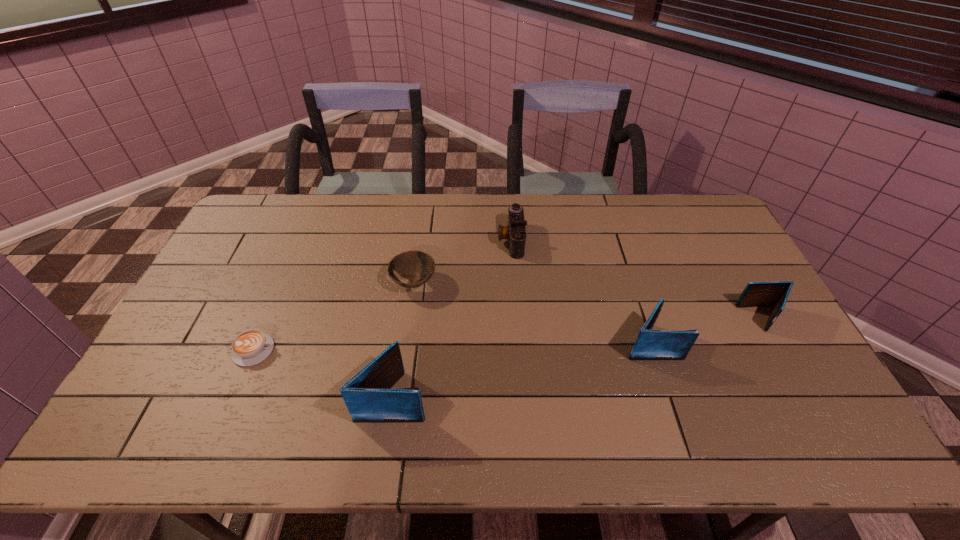
At what (x,y) coordinates should I click in order to perform the action: click on the leftmost wallet. Please return your answer as a coordinate pair (x, y). Looking at the image, I should click on (368, 396).

Image resolution: width=960 pixels, height=540 pixels. Identify the location of the nearest wallet. (368, 396).

Locate an element on the screen. This screenshot has height=540, width=960. the second shortest wallet is located at coordinates (650, 344).

In order to click on the second wallet from left to right in this screenshot , I will do `click(650, 344)`.

You are a GUI agent. You are given a task and a screenshot of the screen. Output one action in this format:
    pyautogui.click(x=<x>, y=<y>)
    Task: Click on the shortest wallet
    
    Given the screenshot: What is the action you would take?
    pyautogui.click(x=774, y=294)

This screenshot has height=540, width=960. I want to click on the rightmost object, so click(x=774, y=294).

I want to click on the third object from right to left, so click(x=515, y=232).

Locate an element on the screen. The width and height of the screenshot is (960, 540). the farthest object is located at coordinates (515, 232).

At what (x,y) coordinates should I click in order to perform the action: click on the shortest object. Please return your answer as a coordinate pair (x, y). The height and width of the screenshot is (540, 960). Looking at the image, I should click on 250,347.

I want to click on cappuccino, so click(x=250, y=347).